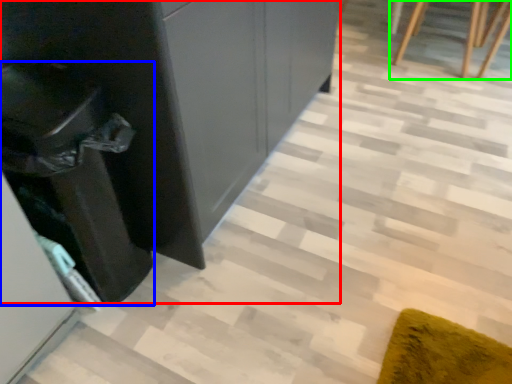
Question: Which object is positioned farthest from dresser (highlighted by a red box)? Select from cabinetry (highlighted by a blue box) and furniture (highlighted by a green box).

Choices:
 (A) cabinetry
 (B) furniture

Answer: (B)